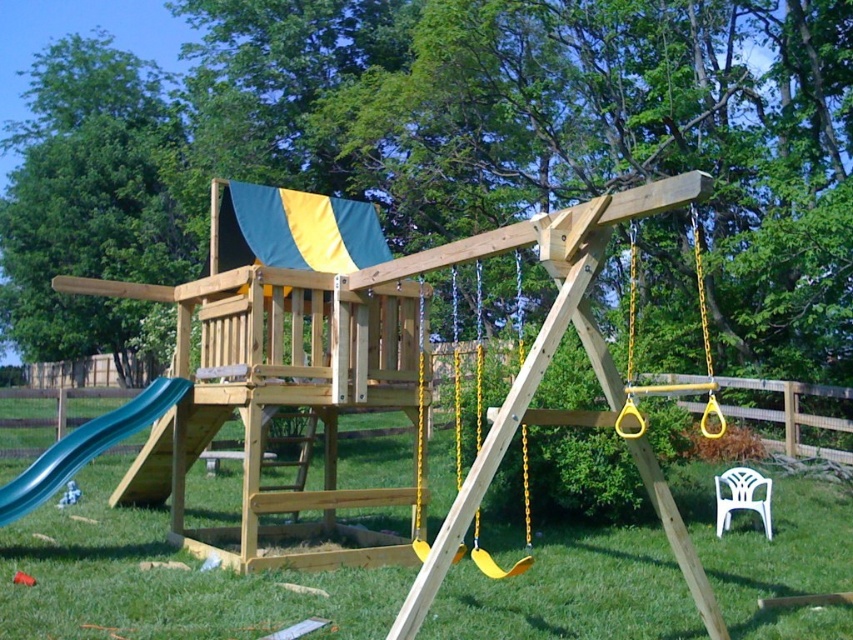
You are a parent trying to place a new toy box in the backyard. The toy box is 1.2 meters wide. You see the yellow plastic swing at center and the white plastic chair at lower right. Which object, if any, would the toy box be wider than?

The yellow plastic swing at center might be wider than white plastic chair at lower right. Since the toy box is 1.2 meters wide, it could potentially be wider than the white plastic chair at lower right if the swing is indeed wider. However, without exact measurements, it is uncertain.

You are a parent supervising children playing in the backyard. You notice the wooden swing set at center and the green plastic slide at lower left. Which object is closer to you, the parent, in the scene?

The wooden swing set at center is closer to you because it is in front of the green plastic slide at lower left, meaning the slide is further back.